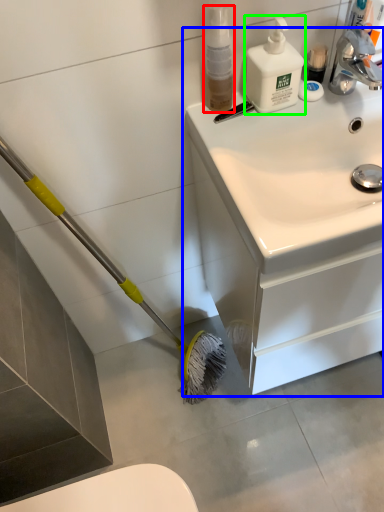
Question: Which is farther away from cleaning product (highlighted by a red box)? bathroom cabinet (highlighted by a blue box) or cleaning product (highlighted by a green box)?

Choices:
 (A) bathroom cabinet
 (B) cleaning product

Answer: (A)